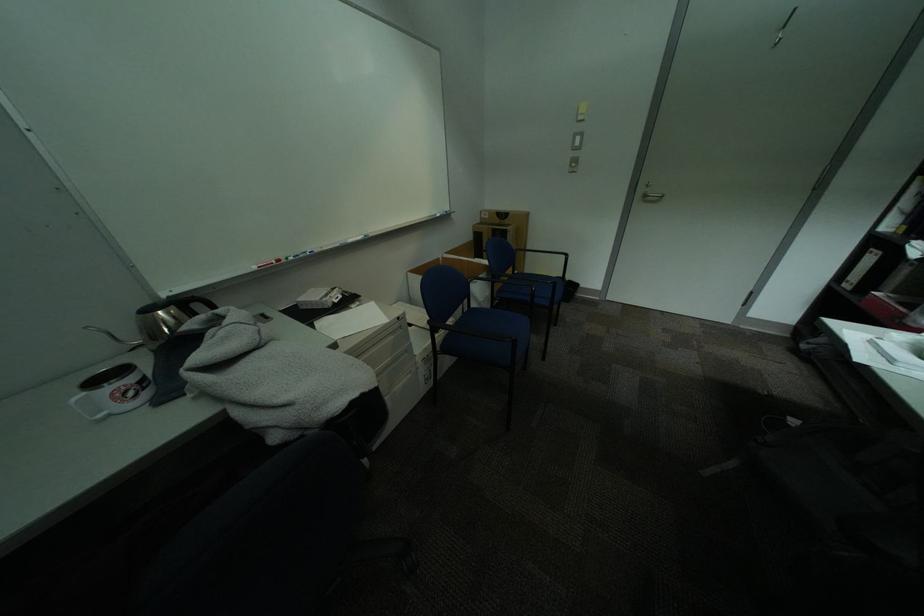
Locate an element on the screen. white mug handle is located at coordinates (88, 408).